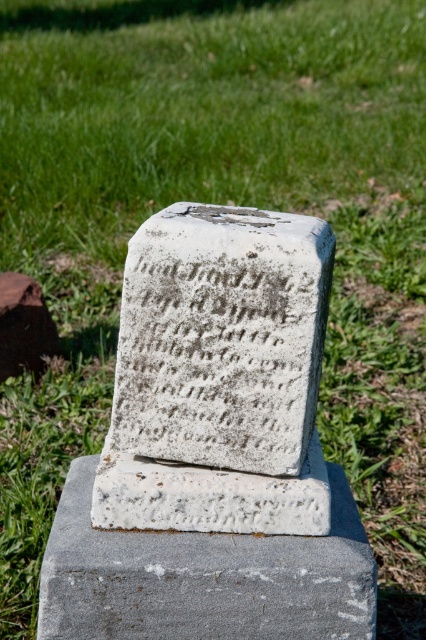
Question: Which is nearer to the brown wood at center?

Choices:
 (A) gray concrete at center
 (B) white stone gravestone at center
 (C) white stone inscription at center

Answer: (A)

Question: Where is white stone gravestone at center located in relation to brown wood at center in the image?

Choices:
 (A) below
 (B) above

Answer: (A)

Question: Can you confirm if white stone inscription at center is wider than gray concrete at center?

Choices:
 (A) yes
 (B) no

Answer: (B)

Question: Is the position of gray concrete at center more distant than that of brown wood at center?

Choices:
 (A) no
 (B) yes

Answer: (A)

Question: Among these objects, which one is nearest to the camera?

Choices:
 (A) white stone inscription at center
 (B) brown wood at center

Answer: (A)

Question: Which point is farther to the camera?

Choices:
 (A) (314, 604)
 (B) (275, 273)
 (C) (5, 332)

Answer: (C)